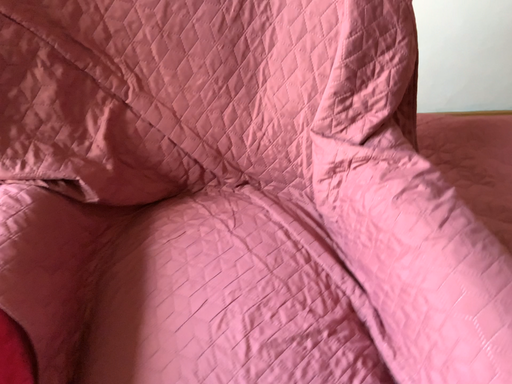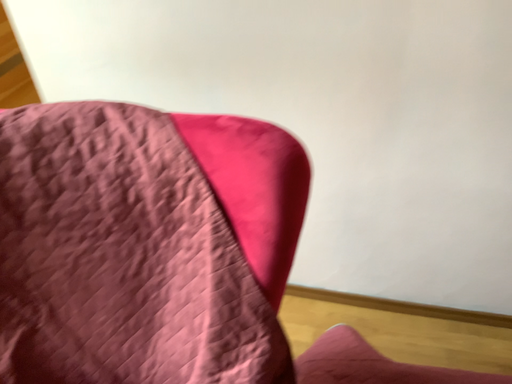
Question: How did the camera likely rotate when shooting the video?

Choices:
 (A) rotated right
 (B) rotated left

Answer: (B)